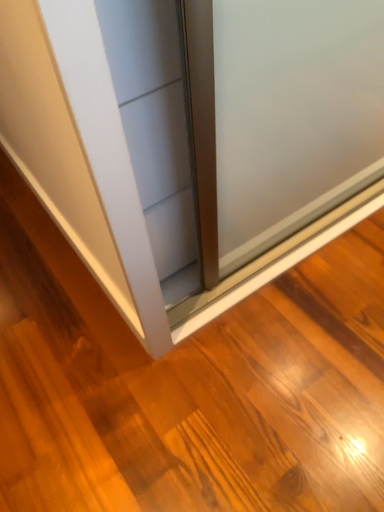
What are the coordinates of `matte white door at center` in the screenshot? It's located at (196, 135).

What do you see at coordinates (196, 135) in the screenshot? I see `matte white door at center` at bounding box center [196, 135].

This screenshot has width=384, height=512. Identify the location of matte white door at center. (196, 135).